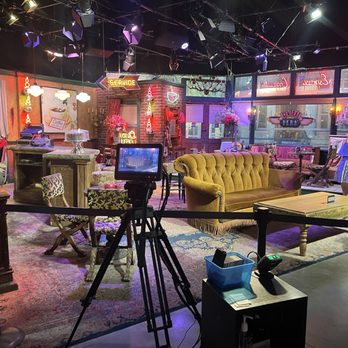
Identify the location of concrete floor. The width and height of the screenshot is (348, 348). (327, 292).